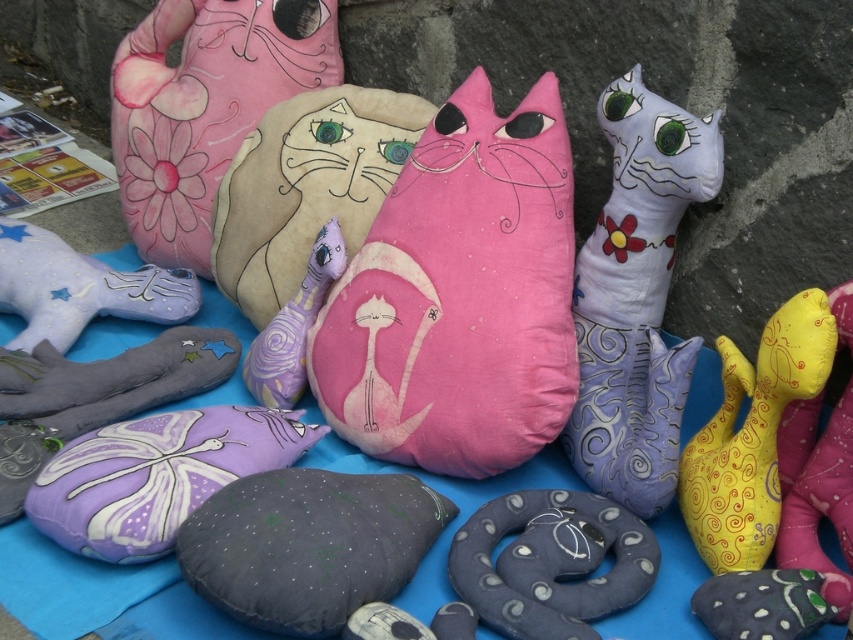
You are a customer at a craft fair and see the purple fabric butterfly at center and the purple fabric cat at center displayed on a blue fabric surface. Which item is positioned nearer to you?

The purple fabric butterfly at center is closer to the viewer than the purple fabric cat at center.